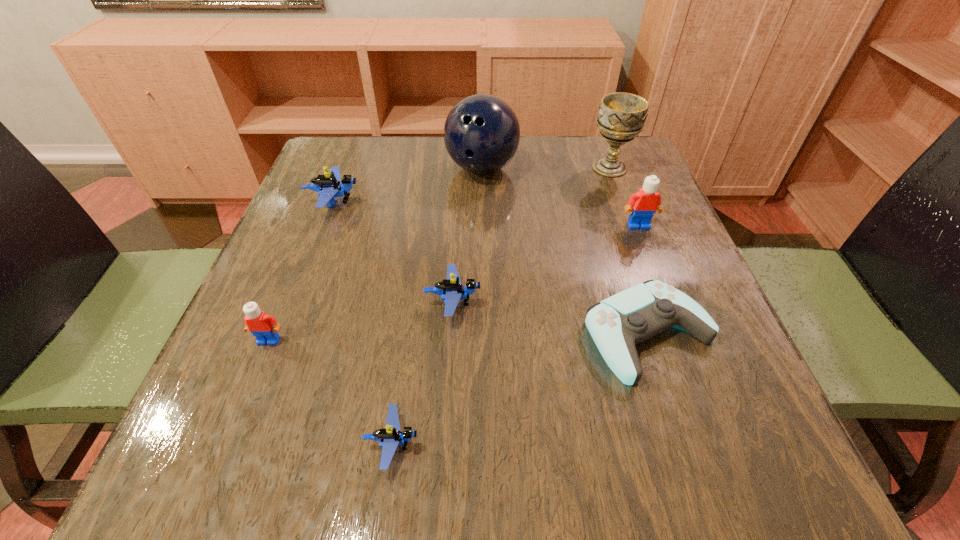
This screenshot has width=960, height=540. What are the coordinates of `control` in the screenshot? It's located at [616, 324].

At what (x,y) coordinates should I click in order to perform the action: click on the smallest blue Lego. Please return your answer as a coordinate pair (x, y). This screenshot has height=540, width=960. Looking at the image, I should click on (390, 437).

I want to click on the nearest object, so click(390, 437).

The width and height of the screenshot is (960, 540). Find the location of `blank space located on the surface of the blue bowling ball near the finger holes`. blank space located on the surface of the blue bowling ball near the finger holes is located at coordinates (482, 284).

Identify the location of vacant space located 0.170m on the left of the white chalice. This screenshot has width=960, height=540. (517, 168).

The image size is (960, 540). I want to click on vacant position located on the face of the rightmost Lego, so click(x=693, y=366).

Where is `vacant area situated on the front-facing side of the biggest blue Lego`? vacant area situated on the front-facing side of the biggest blue Lego is located at coordinates pyautogui.click(x=415, y=202).

I want to click on vacant space located on the face of the nearer white Lego, so click(x=215, y=472).

I want to click on vacant area located on the front-facing side of the second farthest blue Lego, so click(x=514, y=302).

Find the location of a particular element. vacant space located 0.390m on the left of the control is located at coordinates (350, 335).